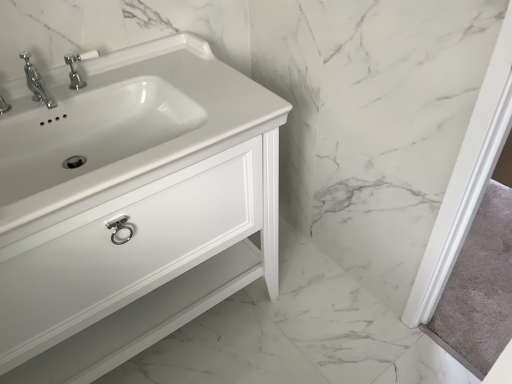
Question: Which is correct: white ceramic tap at upper left is inside white glossy cabinet at left, or outside of it?

Choices:
 (A) inside
 (B) outside

Answer: (A)

Question: Is white ceramic tap at upper left to the left or to the right of white glossy cabinet at left in the image?

Choices:
 (A) left
 (B) right

Answer: (A)

Question: From the image's perspective, is white ceramic tap at upper left positioned above or below white glossy cabinet at left?

Choices:
 (A) above
 (B) below

Answer: (A)

Question: Is white glossy cabinet at left wider or thinner than white ceramic tap at upper left?

Choices:
 (A) thin
 (B) wide

Answer: (B)

Question: From the image's perspective, is white glossy cabinet at left located above or below white ceramic tap at upper left?

Choices:
 (A) above
 (B) below

Answer: (B)

Question: Considering the positions of white glossy cabinet at left and white ceramic tap at upper left in the image, is white glossy cabinet at left bigger or smaller than white ceramic tap at upper left?

Choices:
 (A) big
 (B) small

Answer: (A)

Question: Considering the positions of point (130, 243) and point (74, 56), is point (130, 243) closer or farther from the camera than point (74, 56)?

Choices:
 (A) closer
 (B) farther

Answer: (A)